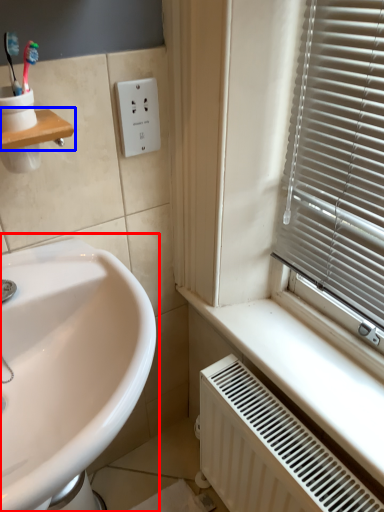
Question: Among these objects, which one is nearest to the camera, sink (highlighted by a red box) or window sill (highlighted by a blue box)?

Choices:
 (A) sink
 (B) window sill

Answer: (A)